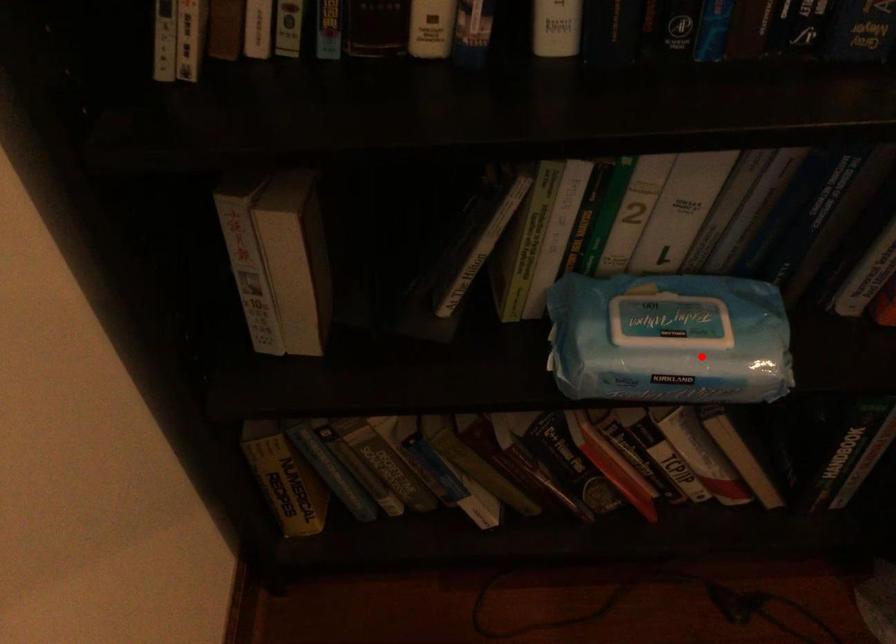
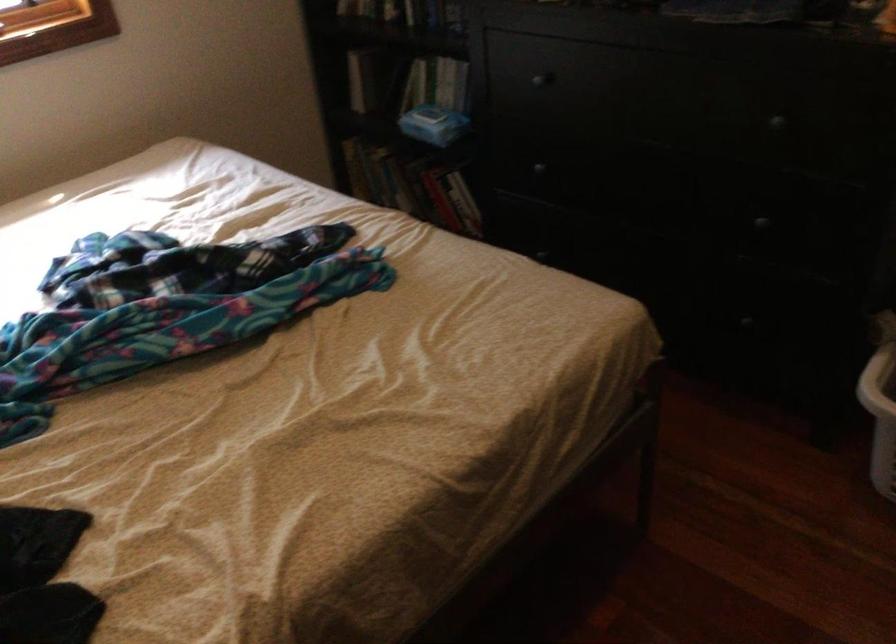
Question: A red point is marked in image1. In image2, is the corresponding 3D point closer to the camera or farther? Reply with the corresponding letter.

Choices:
 (A) The corresponding 3D point is closer.
 (B) The corresponding 3D point is farther.

Answer: (B)